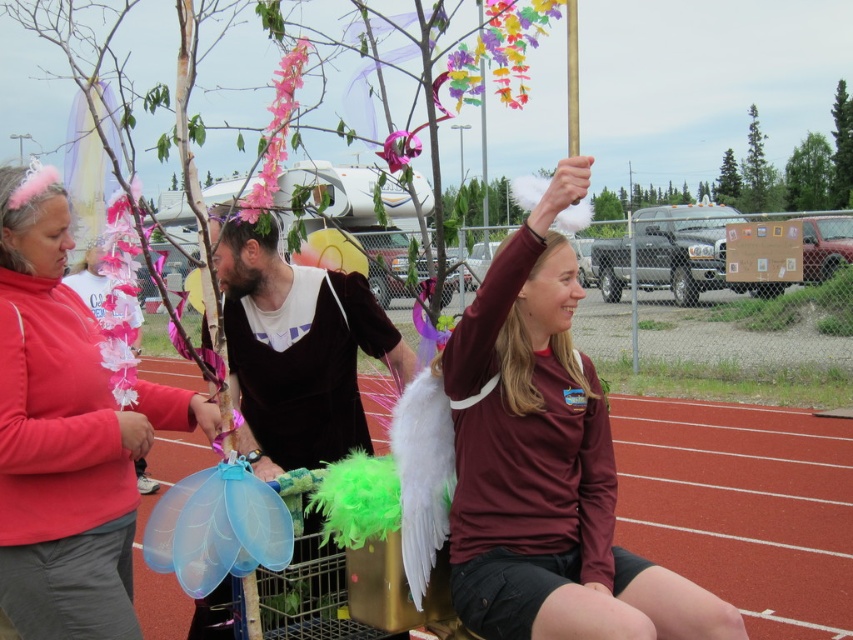
Can you confirm if maroon jersey at center is shorter than matte pink scarf at left?

Indeed, maroon jersey at center has a lesser height compared to matte pink scarf at left.

Is maroon jersey at center further to the viewer compared to matte pink scarf at left?

No, it is not.

You are a GUI agent. You are given a task and a screenshot of the screen. Output one action in this format:
    pyautogui.click(x=<x>, y=<y>)
    Task: Click on the maroon jersey at center
    The height and width of the screenshot is (640, 853).
    Given the screenshot: What is the action you would take?
    pyautogui.click(x=547, y=464)

Is point (509, 301) positioned in front of point (256, 260)?

That is True.

Which is behind, point (508, 376) or point (360, 422)?

Point (360, 422)

At what (x,y) coordinates should I click in order to perform the action: click on maroon jersey at center. Please return your answer as a coordinate pair (x, y). Looking at the image, I should click on (547, 464).

Does matte pink scarf at left lie behind velvet brown shirt at center?

No, matte pink scarf at left is in front of velvet brown shirt at center.

From the picture: Who is more distant from viewer, (86, 355) or (216, 266)?

The point (216, 266) is more distant.

Who is more distant from viewer, (181, 397) or (350, 410)?

The point (350, 410) is behind.

The width and height of the screenshot is (853, 640). I want to click on matte pink scarf at left, so click(65, 435).